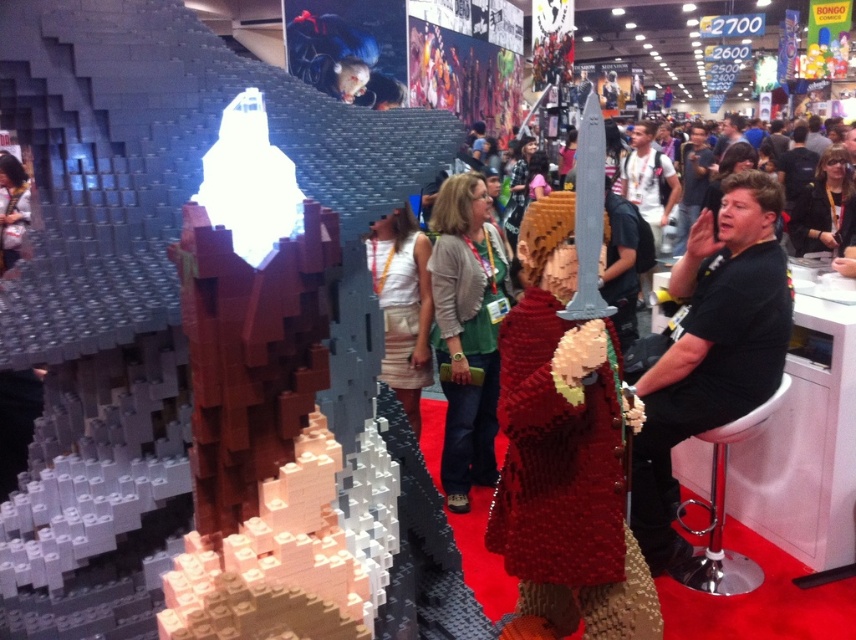
Is red brick armor at center below green fabric jacket at center?

Indeed, red brick armor at center is positioned under green fabric jacket at center.

Which of these two, red brick armor at center or green fabric jacket at center, stands shorter?

red brick armor at center

Is point (530, 307) closer to camera compared to point (440, 364)?

Yes, it is in front of point (440, 364).

The image size is (856, 640). I want to click on red brick armor at center, so click(565, 452).

Is black matte shirt at right in front of white fabric skirt at center?

Yes, black matte shirt at right is in front of white fabric skirt at center.

Looking at this image, does black matte shirt at right appear on the right side of white fabric skirt at center?

Indeed, black matte shirt at right is positioned on the right side of white fabric skirt at center.

Is point (660, 566) positioned in front of point (415, 300)?

Yes.

At what (x,y) coordinates should I click in order to perform the action: click on black matte shirt at right. Please return your answer as a coordinate pair (x, y). The height and width of the screenshot is (640, 856). Looking at the image, I should click on (711, 349).

What do you see at coordinates (711, 349) in the screenshot? The width and height of the screenshot is (856, 640). I see `black matte shirt at right` at bounding box center [711, 349].

Which is in front, point (744, 196) or point (467, 317)?

Point (744, 196)

Who is more distant from viewer, (709, 387) or (461, 236)?

The point (461, 236) is behind.

Image resolution: width=856 pixels, height=640 pixels. Identify the location of black matte shirt at right. (711, 349).